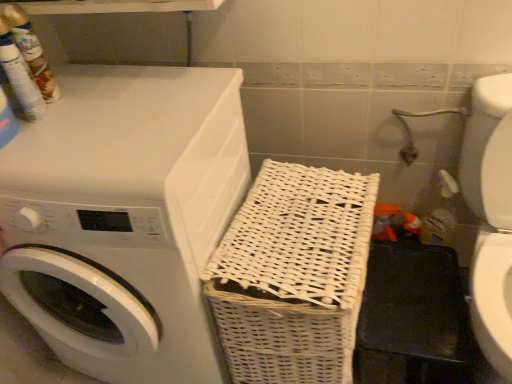
Question: From the image's perspective, is white glossy washer at lower right above or below white matte/woven laundry basket at right?

Choices:
 (A) above
 (B) below

Answer: (B)

Question: Is white glossy washer at lower right to the left or to the right of white matte/woven laundry basket at right in the image?

Choices:
 (A) left
 (B) right

Answer: (B)

Question: Which of these objects is positioned closest to the white matte/woven laundry basket at right?

Choices:
 (A) white glossy washer at lower right
 (B) white wicker basket at center

Answer: (B)

Question: Estimate the real-world distances between objects in this image. Which object is farther from the white wicker basket at center?

Choices:
 (A) white glossy washer at lower right
 (B) white matte/woven laundry basket at right

Answer: (A)